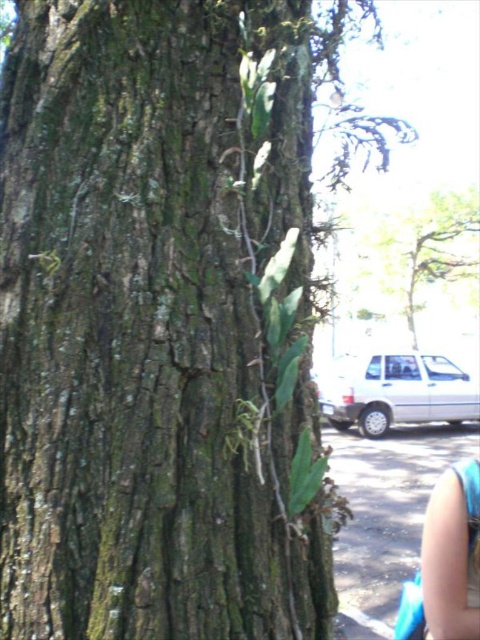
Question: Which of the following is the closest to the observer?

Choices:
 (A) green rough bark at center
 (B) blue fabric arm at lower right

Answer: (A)

Question: Is green rough bark at center bigger than blue fabric arm at lower right?

Choices:
 (A) yes
 (B) no

Answer: (A)

Question: Where is green rough bark at center located in relation to blue fabric arm at lower right in the image?

Choices:
 (A) left
 (B) right

Answer: (A)

Question: Which of the following is the closest to the observer?

Choices:
 (A) green rough bark at center
 (B) blue fabric arm at lower right

Answer: (A)

Question: Which of the following is the closest to the observer?

Choices:
 (A) (x=280, y=88)
 (B) (x=432, y=602)

Answer: (B)

Question: Is green rough bark at center wider than blue fabric arm at lower right?

Choices:
 (A) no
 (B) yes

Answer: (B)